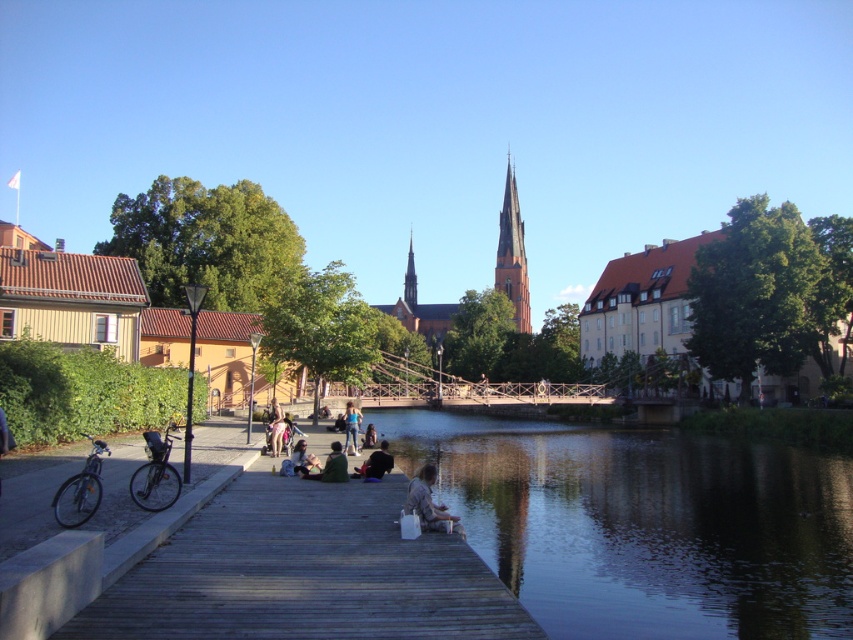
Consider the image. You are standing at the origin point of the coordinate system. Based on the scene, can you determine the 2D coordinates of the dark reflective water at lower center?

The dark reflective water at lower center is located at coordinates point (643, 524).